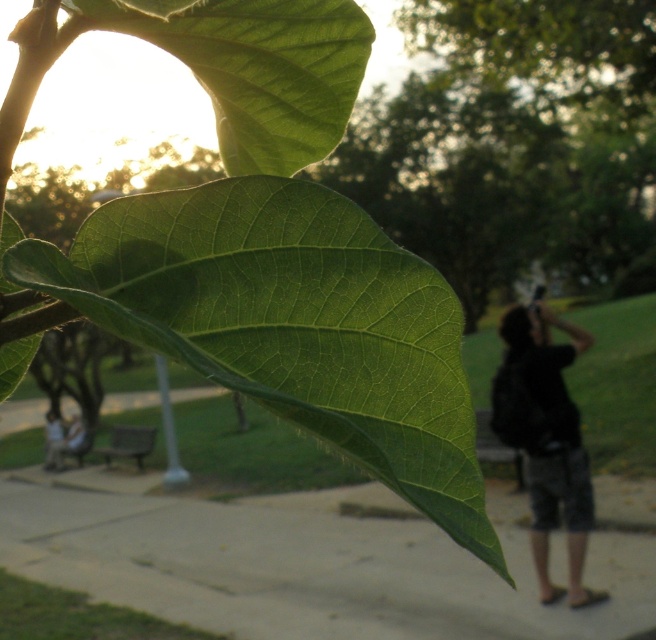
Question: Is smooth concrete pavement at lower center above dark gray cotton hoodie at right?

Choices:
 (A) yes
 (B) no

Answer: (B)

Question: Among these objects, which one is nearest to the camera?

Choices:
 (A) green matte leaf at upper center
 (B) green matte leaf at center
 (C) dark gray cotton hoodie at right
 (D) smooth concrete pavement at lower center

Answer: (B)

Question: Among these points, which one is farthest from the camera?

Choices:
 (A) [x=485, y=557]
 (B) [x=331, y=518]
 (C) [x=255, y=122]
 (D) [x=541, y=378]

Answer: (B)

Question: Does green matte leaf at center lie behind green matte leaf at upper center?

Choices:
 (A) no
 (B) yes

Answer: (A)

Question: Is green matte leaf at upper center positioned behind dark gray cotton hoodie at right?

Choices:
 (A) no
 (B) yes

Answer: (A)

Question: Which of these objects is positioned farthest from the dark gray cotton hoodie at right?

Choices:
 (A) green matte leaf at upper center
 (B) smooth concrete pavement at lower center

Answer: (A)